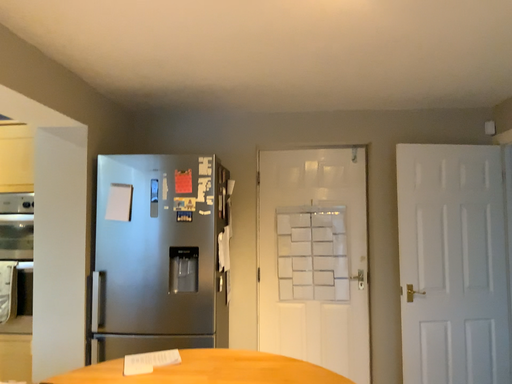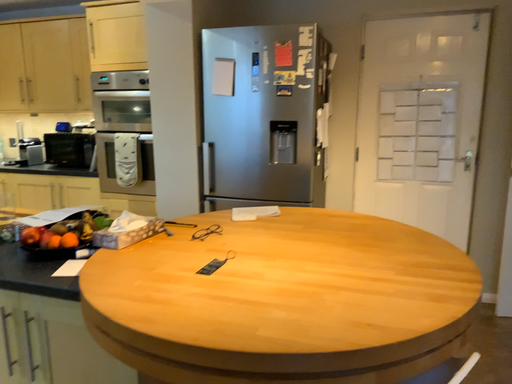
Question: Which way did the camera rotate in the video?

Choices:
 (A) rotated upward
 (B) rotated downward

Answer: (B)